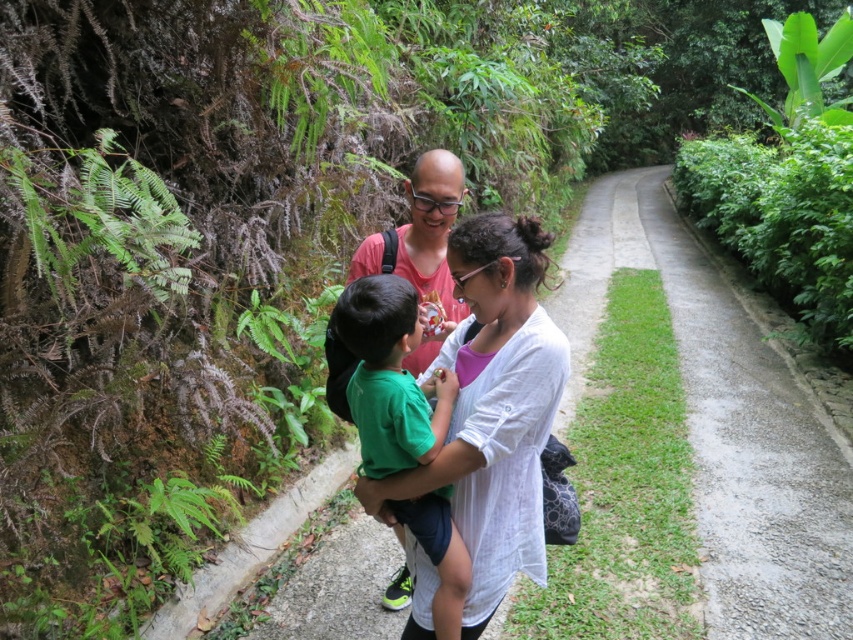
Does gravel path at right appear under green leafy fern at left?

Yes.

The image size is (853, 640). What do you see at coordinates (750, 451) in the screenshot?
I see `gravel path at right` at bounding box center [750, 451].

Does point (712, 344) come farther from viewer compared to point (78, 163)?

Yes, it is.

This screenshot has width=853, height=640. I want to click on gravel path at right, so click(750, 451).

Is green cotton shirt at center below green leafy fern at left?

Correct, green cotton shirt at center is located below green leafy fern at left.

Measure the distance between green cotton shirt at center and camera.

green cotton shirt at center and camera are 1.81 meters apart.

Find the location of a particular element. This screenshot has width=853, height=640. green cotton shirt at center is located at coordinates (389, 378).

Does white cotton shirt at center come behind green cotton shirt at center?

Yes.

Which is behind, point (544, 564) or point (432, 452)?

Positioned behind is point (544, 564).

Between point (529, 513) and point (402, 448), which one is positioned in front?

Point (402, 448) is in front.

Where is `white cotton shirt at center`? The height and width of the screenshot is (640, 853). white cotton shirt at center is located at coordinates (494, 408).